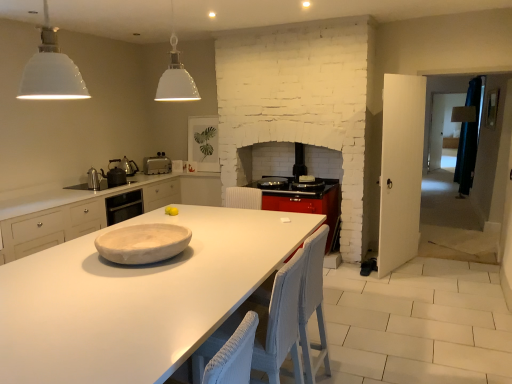
Question: From the image's perspective, is metallic silver kettle at left, which is the 2th appliance from back to front, above white matte pendant light at upper left, acting as the 2th light fixture starting from the right?

Choices:
 (A) yes
 (B) no

Answer: (B)

Question: From the image's perspective, is metallic silver kettle at left, which is the 2th appliance from back to front, under white matte pendant light at upper left, which is the second light fixture from back to front?

Choices:
 (A) no
 (B) yes

Answer: (B)

Question: Is metallic silver kettle at left, which is the 2th appliance from back to front, wider than white matte pendant light at upper left, which is the second light fixture from back to front?

Choices:
 (A) no
 (B) yes

Answer: (A)

Question: Is metallic silver kettle at left, acting as the third appliance starting from the front, outside of white matte pendant light at upper left, acting as the 2th light fixture starting from the right?

Choices:
 (A) no
 (B) yes

Answer: (B)

Question: From a real-world perspective, is metallic silver kettle at left, acting as the third appliance starting from the front, beneath white matte pendant light at upper left, acting as the first light fixture starting from the front?

Choices:
 (A) no
 (B) yes

Answer: (B)

Question: Considering the relative positions of metallic silver kettle at left, positioned as the first appliance in front-to-back order, and white marble platter at center in the image provided, is metallic silver kettle at left, positioned as the first appliance in front-to-back order, to the left or to the right of white marble platter at center?

Choices:
 (A) right
 (B) left

Answer: (B)

Question: Which is correct: metallic silver kettle at left, which is the fourth appliance from back to front, is inside white marble platter at center, or outside of it?

Choices:
 (A) inside
 (B) outside

Answer: (B)

Question: From a real-world perspective, is metallic silver kettle at left, which is the fourth appliance from back to front, above or below white marble platter at center?

Choices:
 (A) below
 (B) above

Answer: (B)

Question: Looking at their shapes, would you say metallic silver kettle at left, positioned as the first appliance in front-to-back order, is wider or thinner than white marble platter at center?

Choices:
 (A) thin
 (B) wide

Answer: (A)

Question: From the image's perspective, is white wicker chair at center, acting as the second chair starting from the back, located above or below silver metallic toaster at center, the first appliance when ordered from back to front?

Choices:
 (A) below
 (B) above

Answer: (A)

Question: In terms of width, does white wicker chair at center, the first chair from the front, look wider or thinner when compared to silver metallic toaster at center, the fourth appliance from the front?

Choices:
 (A) wide
 (B) thin

Answer: (A)

Question: Choose the correct answer: Is white wicker chair at center, the first chair from the front, inside silver metallic toaster at center, the fourth appliance from the front, or outside it?

Choices:
 (A) inside
 (B) outside

Answer: (B)

Question: Considering the positions of white wicker chair at center, acting as the second chair starting from the back, and silver metallic toaster at center, the first appliance when ordered from back to front, in the image, is white wicker chair at center, acting as the second chair starting from the back, bigger or smaller than silver metallic toaster at center, the first appliance when ordered from back to front,?

Choices:
 (A) small
 (B) big

Answer: (B)

Question: From a real-world perspective, is white wicker chair at center, acting as the second chair starting from the back, above or below metallic silver kettle at left, which is the 2th appliance from back to front?

Choices:
 (A) above
 (B) below

Answer: (B)

Question: From their relative heights in the image, would you say white wicker chair at center, acting as the second chair starting from the back, is taller or shorter than metallic silver kettle at left, acting as the third appliance starting from the front?

Choices:
 (A) tall
 (B) short

Answer: (A)